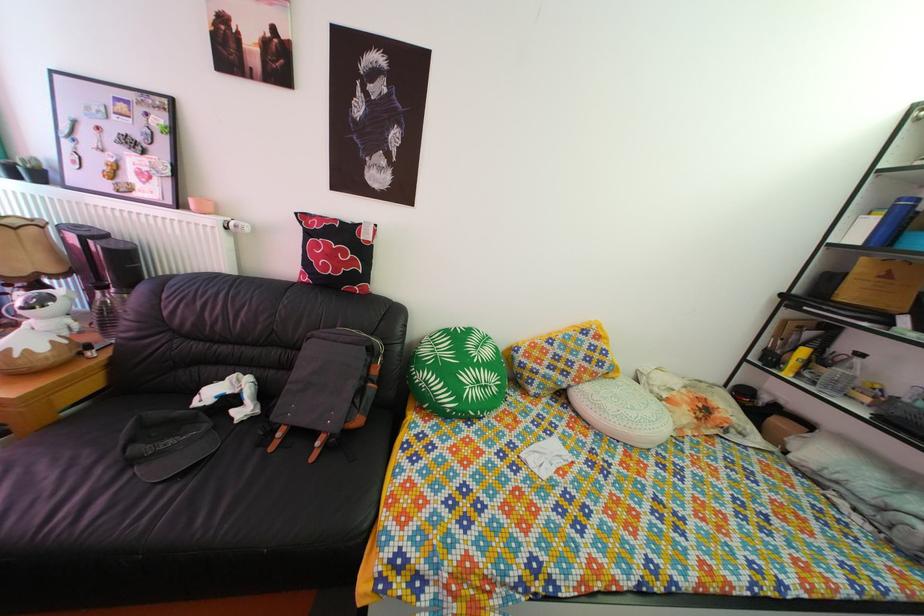
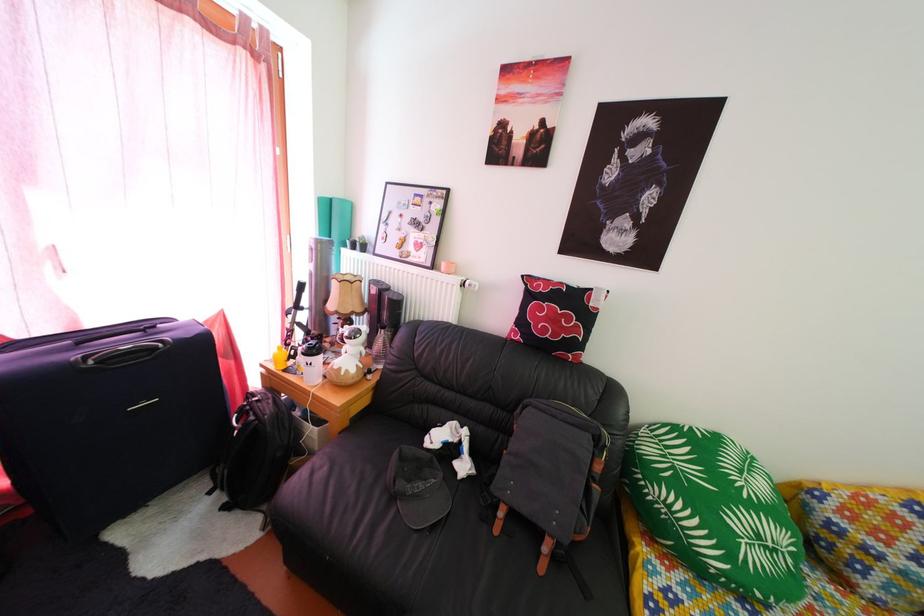
In the second image, find the point that corresponds to pixel 225 222 in the first image.

(464, 282)